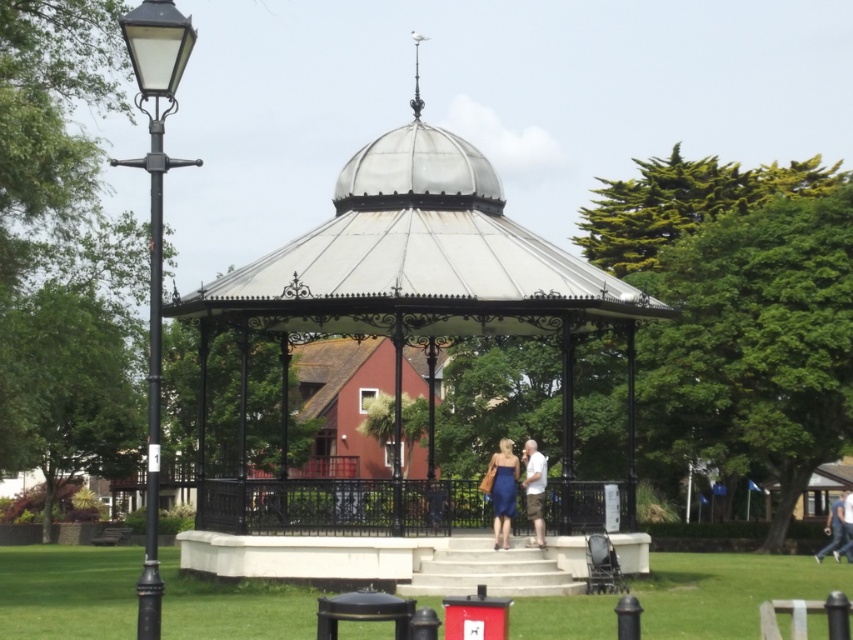
You are a photographer setting up a shoot in the park. You have two props to place in the scene according to their sizes. The light brown leather jacket at lower center and the light blue denim jeans at lower right. Which prop should you place closer to the camera to make them appear the same size in the final photo?

The light brown leather jacket at lower center is smaller in size, so you should place it closer to the camera. The light blue denim jeans at lower right are larger, so placing them farther away will help both props appear the same size in the photo.

You are a photographer positioned at the entrance of the gazebo. You want to capture a photo of both the matte blue dress at center and the light blue denim jeans at lower right. Which of the two items will appear larger in the photo?

The matte blue dress at center will appear larger in the photo because it is closer to the viewer than the light blue denim jeans at lower right.

You are standing in the park and see the polished metal gazebo at center and the matte blue dress at center. Which object is positioned to the right side of the other?

The polished metal gazebo at center is positioned to the right of matte blue dress at center.